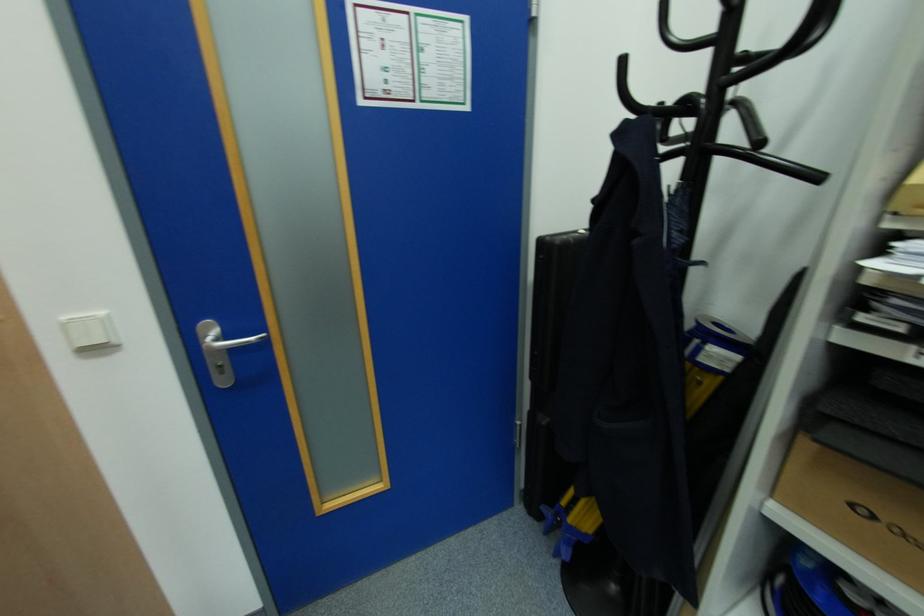
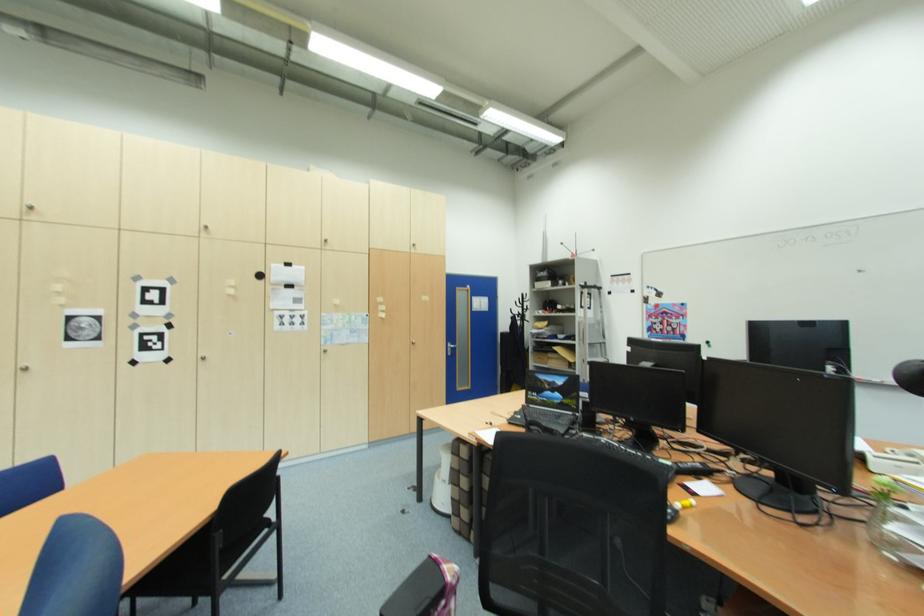
Where in the second image is the point corresponding to the point at 237,350 from the first image?

(456, 350)